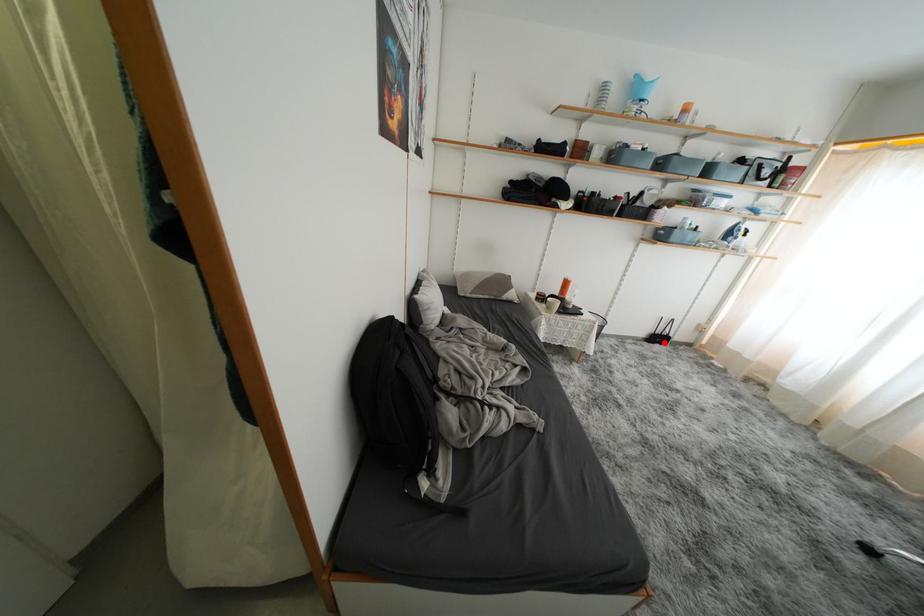
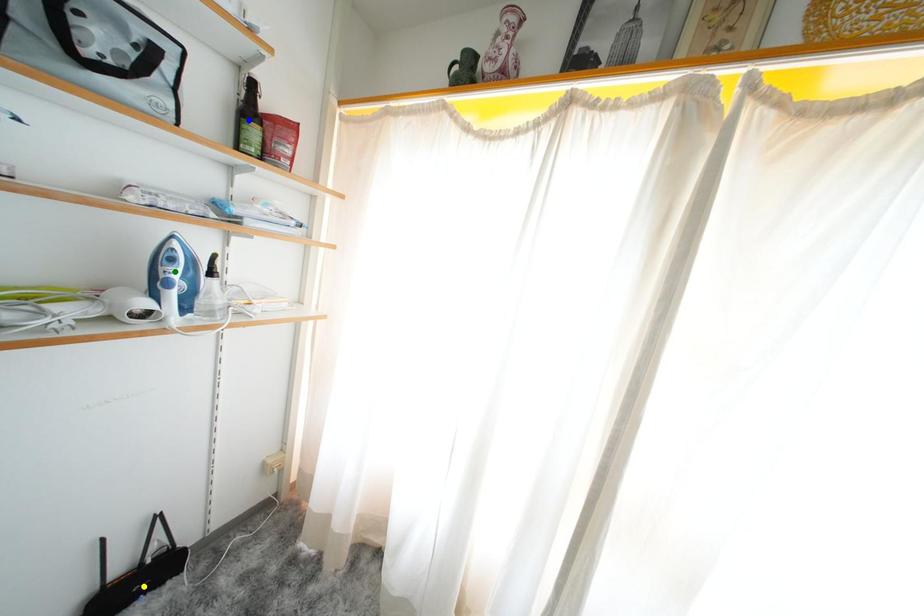
Question: I am providing you with two images of the same scene from different viewpoints. A red point is marked on the first image. You are given multiple points on the second image. Which spot in image 2 lines up with the point in image 1?

Choices:
 (A) green point
 (B) yellow point
 (C) blue point

Answer: (B)